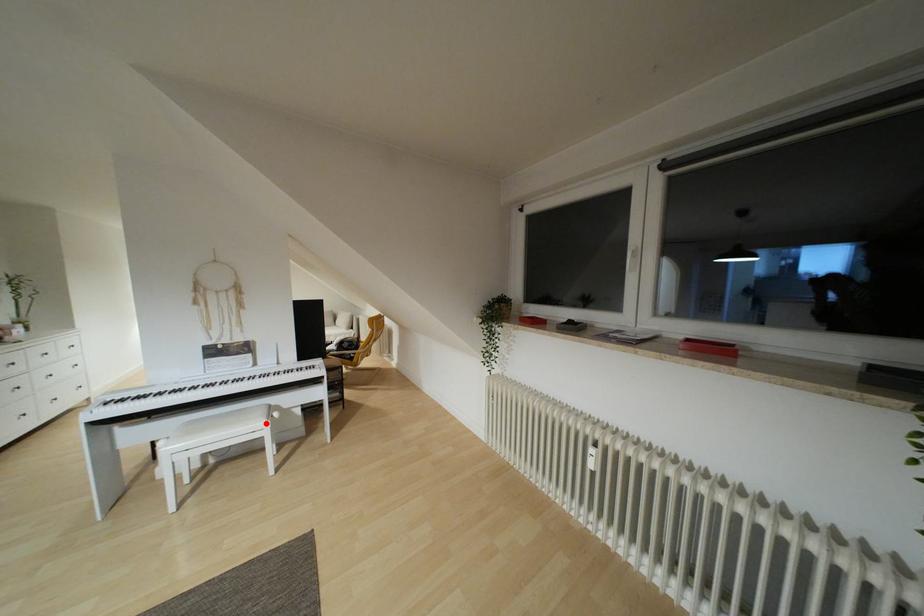
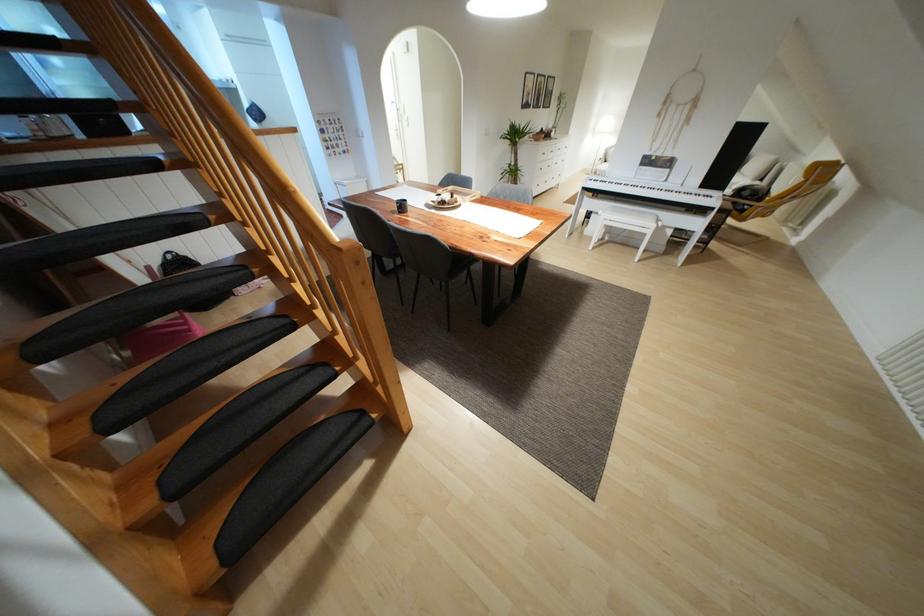
In the second image, find the point that corresponds to the highlighted location in the first image.

(652, 225)